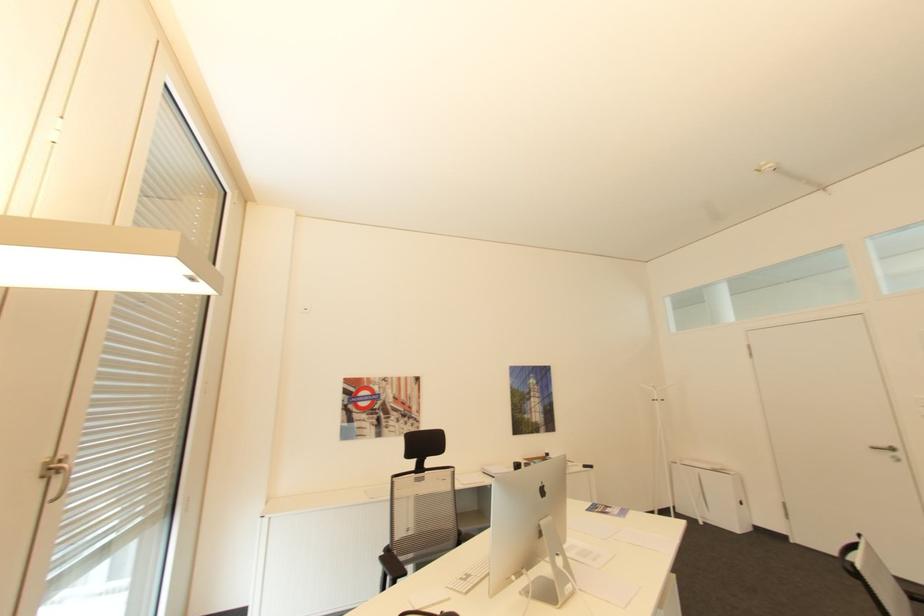
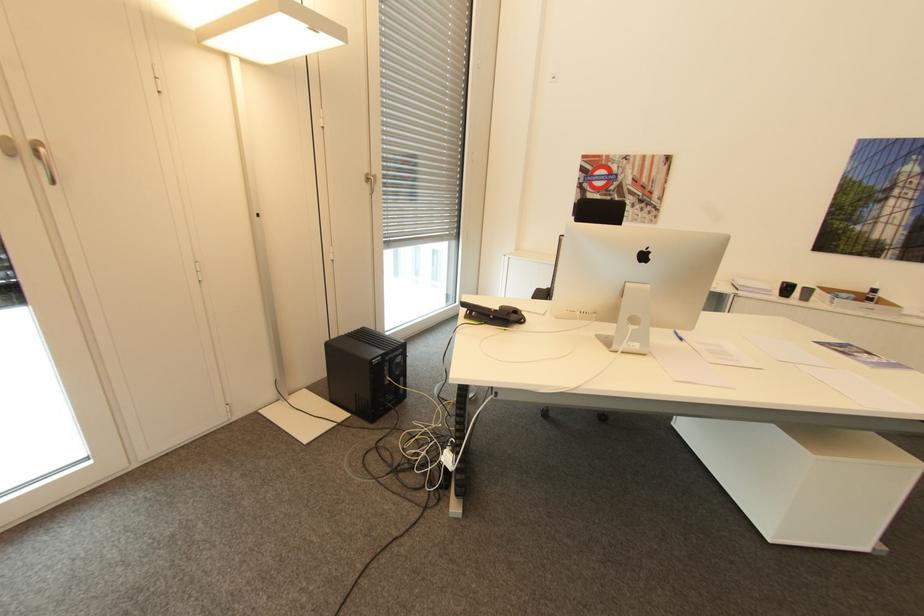
The point at (x=553, y=454) is marked in the first image. Where is the corresponding point in the second image?

(879, 290)